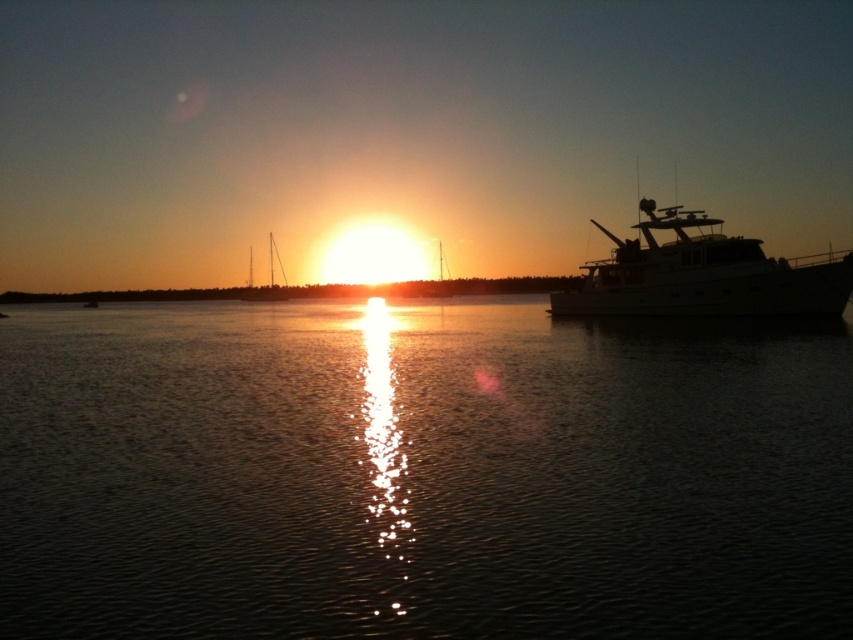
Question: In this image, where is glistening water at center located relative to white glossy boat at right?

Choices:
 (A) left
 (B) right

Answer: (A)

Question: Which point is closer to the camera?

Choices:
 (A) white glossy boat at right
 (B) glistening water at center

Answer: (B)

Question: Does glistening water at center appear over white glossy boat at right?

Choices:
 (A) yes
 (B) no

Answer: (B)

Question: Which object appears closest to the camera in this image?

Choices:
 (A) glistening water at center
 (B) white glossy boat at right

Answer: (A)

Question: Which point is farther to the camera?

Choices:
 (A) glistening water at center
 (B) white glossy boat at right

Answer: (B)

Question: Can you confirm if glistening water at center is positioned to the left of white glossy boat at right?

Choices:
 (A) no
 (B) yes

Answer: (B)